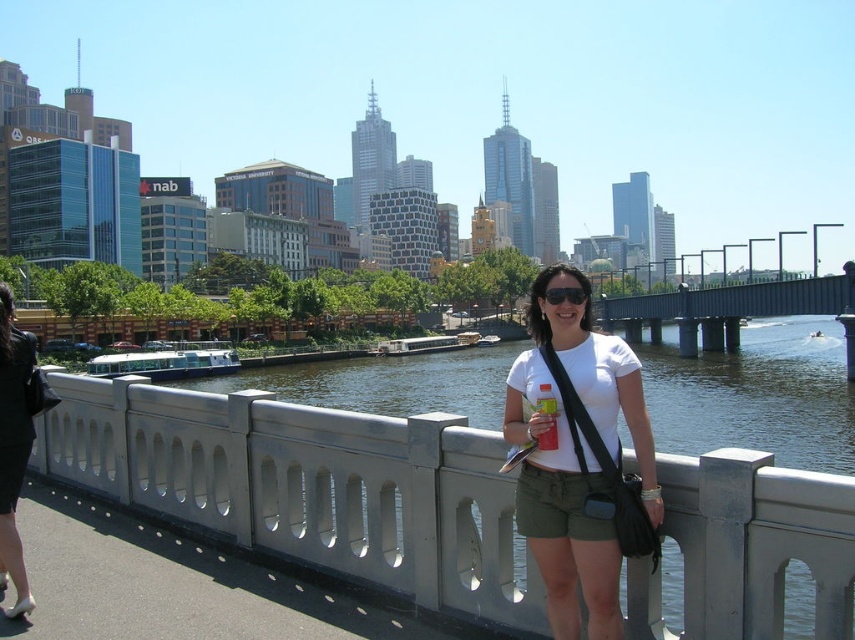
Question: Which of the following is the closest to the observer?

Choices:
 (A) (540, 275)
 (B) (543, 296)

Answer: (B)

Question: Among these points, which one is nearest to the camera?

Choices:
 (A) (18, 557)
 (B) (202, 481)

Answer: (A)

Question: Can you confirm if black leather jacket at left is positioned to the right of gray concrete bridge at center?

Choices:
 (A) yes
 (B) no

Answer: (B)

Question: Which point appears closest to the camera in this image?

Choices:
 (A) (263, 403)
 (B) (787, 288)

Answer: (A)

Question: Can you confirm if gray concrete railing at center is positioned below gray concrete bridge at center?

Choices:
 (A) no
 (B) yes

Answer: (B)

Question: Can you confirm if white matte t-shirt at center is positioned to the right of black matte sunglasses at center?

Choices:
 (A) yes
 (B) no

Answer: (B)